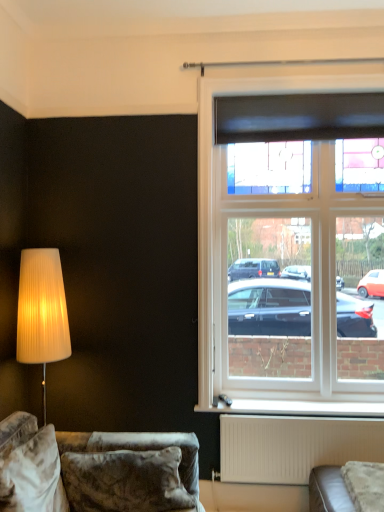
Question: Considering the relative sizes of velvet couch at lower left and stained glass window at upper right in the image provided, is velvet couch at lower left taller than stained glass window at upper right?

Choices:
 (A) no
 (B) yes

Answer: (A)

Question: Is velvet couch at lower left facing away from stained glass window at upper right?

Choices:
 (A) no
 (B) yes

Answer: (A)

Question: From a real-world perspective, is velvet couch at lower left beneath stained glass window at upper right?

Choices:
 (A) no
 (B) yes

Answer: (B)

Question: Considering the relative sizes of velvet couch at lower left and stained glass window at upper right in the image provided, is velvet couch at lower left bigger than stained glass window at upper right?

Choices:
 (A) yes
 (B) no

Answer: (A)

Question: Is the position of velvet couch at lower left more distant than that of stained glass window at upper right?

Choices:
 (A) yes
 (B) no

Answer: (B)

Question: Which is correct: stained glass window at upper right is inside white matte radiator at lower center, or outside of it?

Choices:
 (A) inside
 (B) outside

Answer: (B)

Question: Considering their positions, is stained glass window at upper right located in front of or behind white matte radiator at lower center?

Choices:
 (A) front
 (B) behind

Answer: (B)

Question: From a real-world perspective, is stained glass window at upper right above or below white matte radiator at lower center?

Choices:
 (A) above
 (B) below

Answer: (A)

Question: Is point (332, 346) positioned closer to the camera than point (362, 425)?

Choices:
 (A) closer
 (B) farther

Answer: (B)

Question: In terms of height, does white plastic window sill at lower center look taller or shorter compared to stained glass window at upper right?

Choices:
 (A) short
 (B) tall

Answer: (A)

Question: From a real-world perspective, is white plastic window sill at lower center above or below stained glass window at upper right?

Choices:
 (A) below
 (B) above

Answer: (A)

Question: Based on their sizes in the image, would you say white plastic window sill at lower center is bigger or smaller than stained glass window at upper right?

Choices:
 (A) small
 (B) big

Answer: (A)

Question: Visually, is white plastic window sill at lower center positioned to the left or to the right of stained glass window at upper right?

Choices:
 (A) right
 (B) left

Answer: (A)

Question: Visually, is white matte radiator at lower center positioned to the left or to the right of stained glass window at upper right?

Choices:
 (A) left
 (B) right

Answer: (B)

Question: Is white matte radiator at lower center inside or outside of stained glass window at upper right?

Choices:
 (A) outside
 (B) inside

Answer: (A)